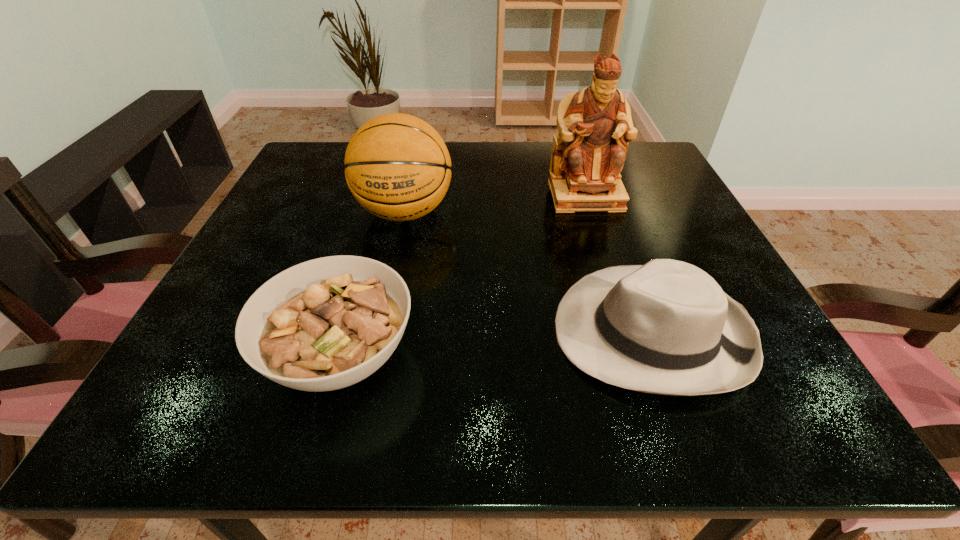
I want to click on figurine, so click(595, 125).

Identify the location of basketball. This screenshot has width=960, height=540. (398, 168).

Find the location of a particular element. This screenshot has height=540, width=960. fedora is located at coordinates (667, 327).

Where is `stew`? stew is located at coordinates (325, 324).

Where is `free spot located on the front-facing side of the tallest object`? Image resolution: width=960 pixels, height=540 pixels. free spot located on the front-facing side of the tallest object is located at coordinates (604, 253).

Locate an element on the screen. The height and width of the screenshot is (540, 960). vacant space located on the surface of the basketball near the brand logo is located at coordinates (378, 335).

Find the location of a particular element. Image resolution: width=960 pixels, height=540 pixels. free region located 0.070m on the front-facing side of the fedora is located at coordinates (511, 333).

The height and width of the screenshot is (540, 960). Identify the location of vacant space located 0.140m on the front-facing side of the fedora. (466, 333).

Image resolution: width=960 pixels, height=540 pixels. I want to click on free region located 0.250m on the front-facing side of the fedora, so click(x=396, y=333).

Find the location of a particular element. Image resolution: width=960 pixels, height=540 pixels. free space located on the right of the stew is located at coordinates (585, 355).